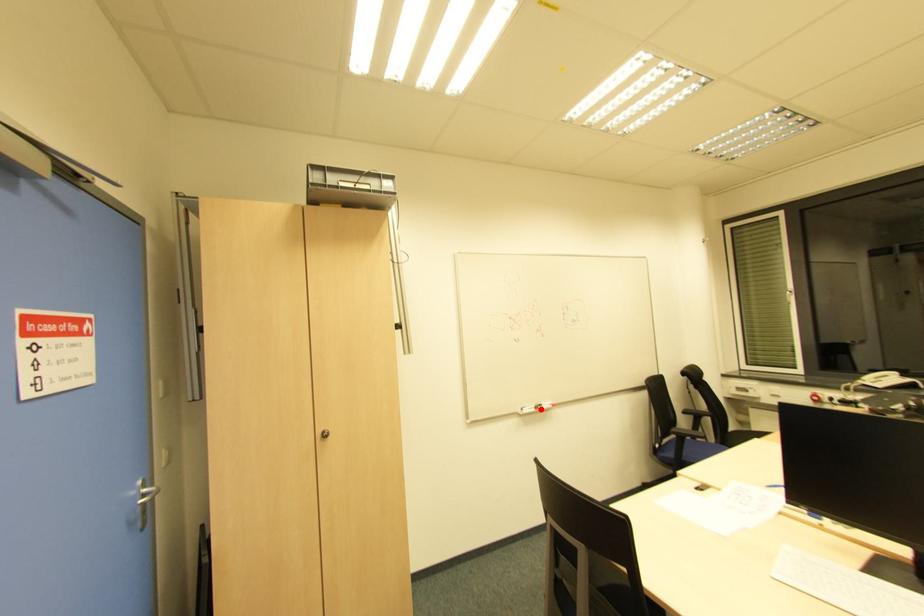
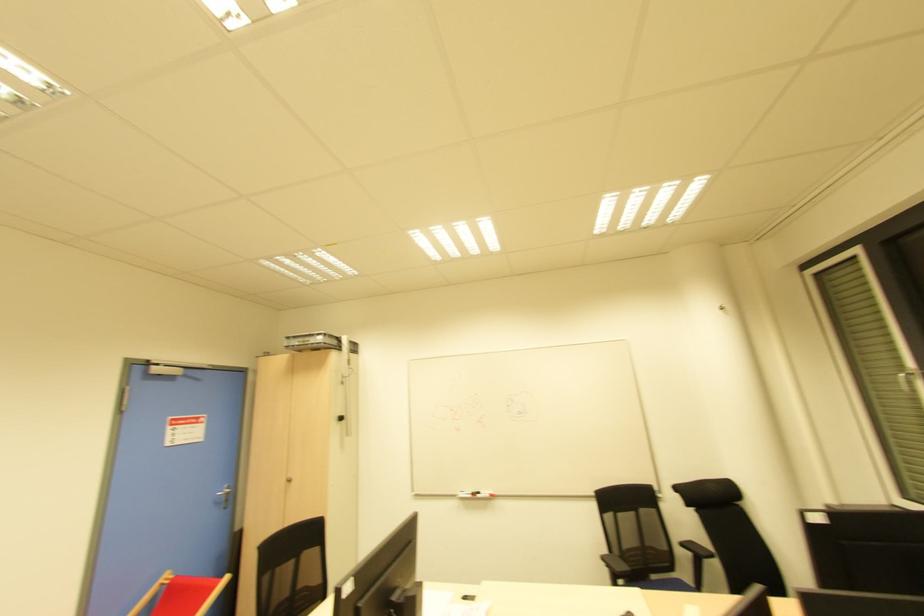
Locate, in the second image, the point that corresponds to the highlighted location in the first image.

(478, 496)